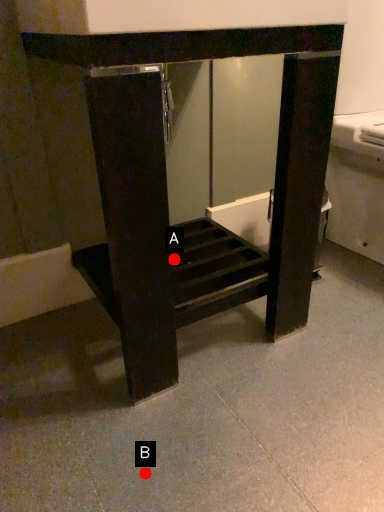
Question: Two points are circled on the image, labeled by A and B beside each circle. Which point is farther from the camera taking this photo?

Choices:
 (A) A is further
 (B) B is further

Answer: (A)